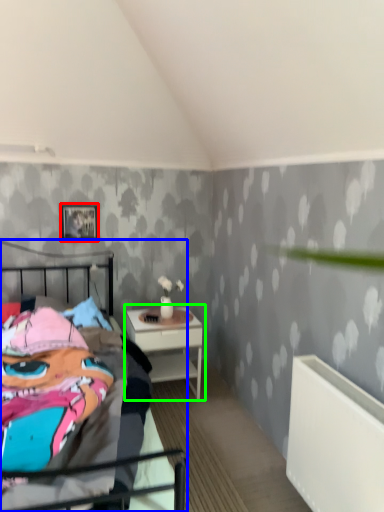
Question: Which object is positioned closest to picture frame (highlighted by a red box)? Select from bed (highlighted by a blue box) and nightstand (highlighted by a green box).

Choices:
 (A) bed
 (B) nightstand

Answer: (B)